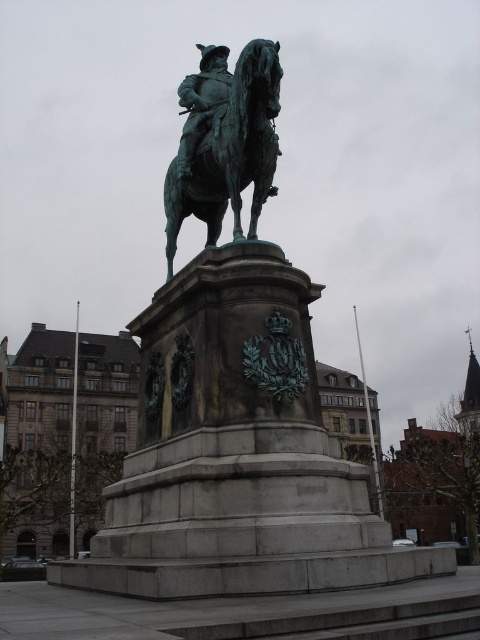
Who is positioned more to the right, bronze statue at center or polished bronze rider at center?

From the viewer's perspective, bronze statue at center appears more on the right side.

Measure the distance between bronze statue at center and polished bronze rider at center.

They are 4.82 meters apart.

At what (x,y) coordinates should I click in order to perform the action: click on bronze statue at center. Please return your answer as a coordinate pair (x, y). This screenshot has height=640, width=480. Looking at the image, I should click on (225, 141).